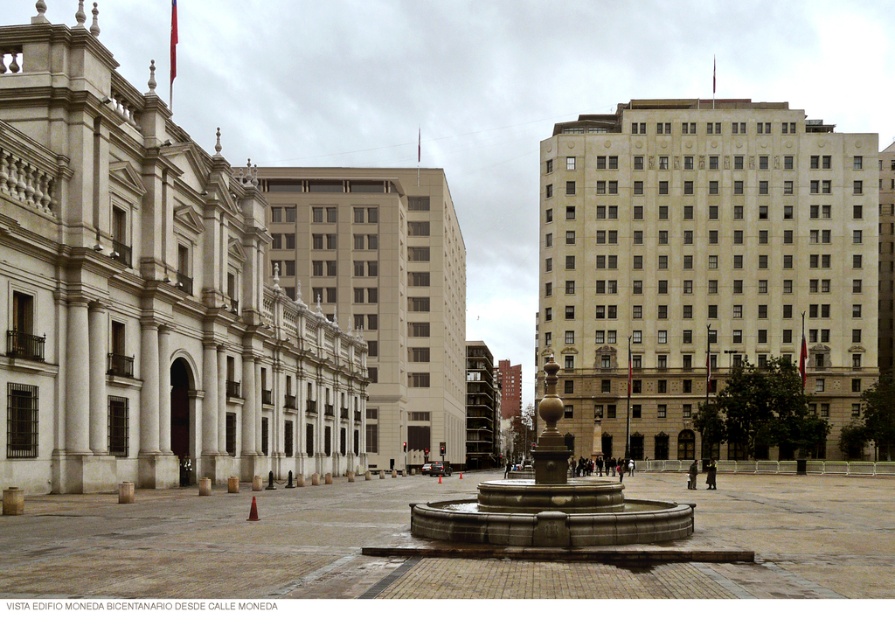
Does beige stone building at center have a greater width compared to granite fountain at center?

Yes, beige stone building at center is wider than granite fountain at center.

Between beige stone building at center and granite fountain at center, which one has less height?

Standing shorter between the two is granite fountain at center.

Locate an element on the screen. This screenshot has width=895, height=640. beige stone building at center is located at coordinates (701, 264).